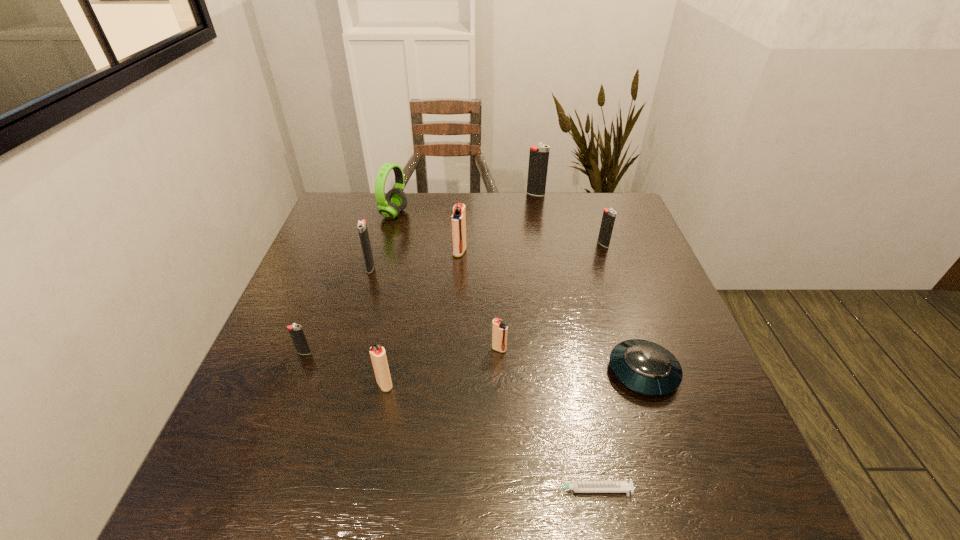
The image size is (960, 540). Identify the location of vacant space that satisfies the following two spatial constraints: 1. on the back side of the biggest red igniter; 2. on the right side of the farthest object. (463, 194).

This screenshot has height=540, width=960. Identify the location of free spot that satisfies the following two spatial constraints: 1. on the front side of the second shortest object; 2. on the left side of the third smallest black igniter. (340, 372).

This screenshot has width=960, height=540. Find the location of `vacant space that satisfies the following two spatial constraints: 1. on the back side of the leftmost red igniter; 2. on the right side of the rightmost igniter`. vacant space that satisfies the following two spatial constraints: 1. on the back side of the leftmost red igniter; 2. on the right side of the rightmost igniter is located at coordinates (412, 244).